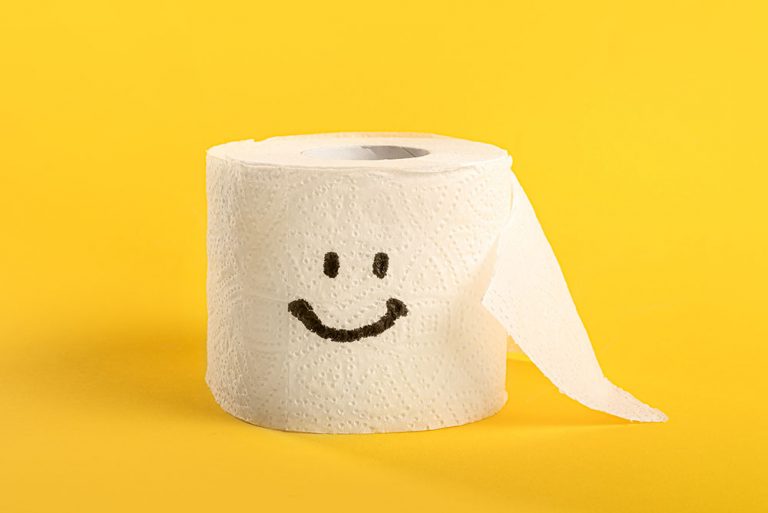
At what (x,y) coordinates should I click in order to perform the action: click on toilet roll. Please return your answer as a coordinate pair (x, y). Looking at the image, I should click on (439, 285).